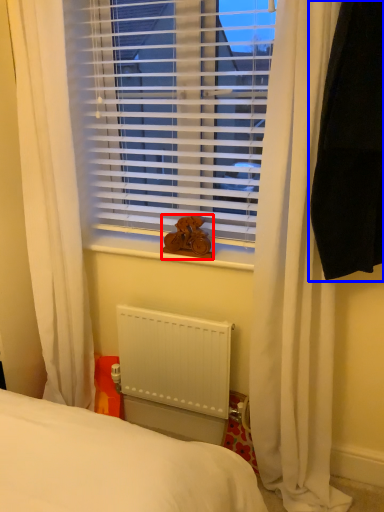
Question: Which point is further to the camera, animal (highlighted by a red box) or curtain (highlighted by a blue box)?

Choices:
 (A) animal
 (B) curtain

Answer: (A)